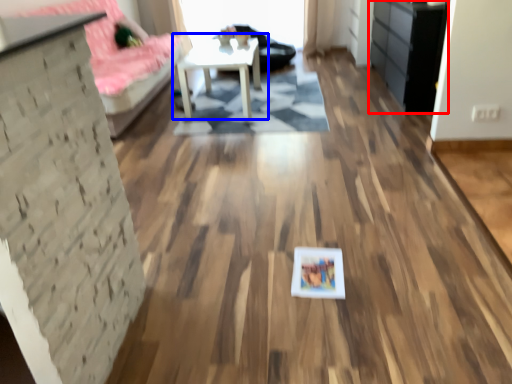
Question: Which of the following is the closest to the observer, dresser (highlighted by a red box) or table (highlighted by a blue box)?

Choices:
 (A) dresser
 (B) table

Answer: (A)